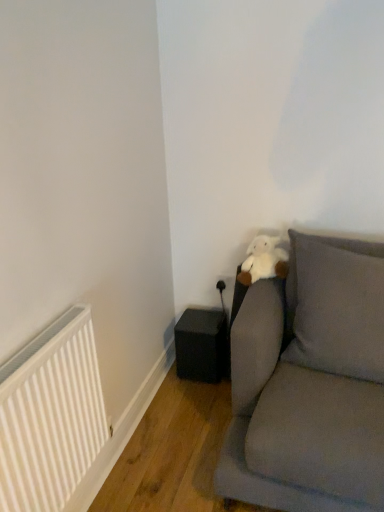
Question: Is gray fabric pillow at upper right completely or partially inside velvet gray couch at right?

Choices:
 (A) yes
 (B) no

Answer: (A)

Question: Is velvet gray couch at right not inside gray fabric pillow at upper right?

Choices:
 (A) no
 (B) yes

Answer: (B)

Question: Is velvet gray couch at right next to gray fabric pillow at upper right and touching it?

Choices:
 (A) no
 (B) yes

Answer: (A)

Question: Is the depth of velvet gray couch at right less than that of gray fabric pillow at upper right?

Choices:
 (A) no
 (B) yes

Answer: (B)

Question: From the image's perspective, is velvet gray couch at right over gray fabric pillow at upper right?

Choices:
 (A) yes
 (B) no

Answer: (B)

Question: From the image's perspective, does velvet gray couch at right appear lower than gray fabric pillow at upper right?

Choices:
 (A) yes
 (B) no

Answer: (A)

Question: Can you confirm if gray fabric pillow at upper right is wider than velvet gray couch at right?

Choices:
 (A) no
 (B) yes

Answer: (A)

Question: Does gray fabric pillow at upper right have a larger size compared to velvet gray couch at right?

Choices:
 (A) no
 (B) yes

Answer: (A)

Question: Is gray fabric pillow at upper right behind velvet gray couch at right?

Choices:
 (A) yes
 (B) no

Answer: (A)

Question: Is gray fabric pillow at upper right oriented away from velvet gray couch at right?

Choices:
 (A) yes
 (B) no

Answer: (A)

Question: Can you confirm if gray fabric pillow at upper right is positioned to the left of velvet gray couch at right?

Choices:
 (A) no
 (B) yes

Answer: (A)

Question: Could you tell me if gray fabric pillow at upper right is facing velvet gray couch at right?

Choices:
 (A) yes
 (B) no

Answer: (A)

Question: Considering the relative sizes of black matte speaker at lower left and velvet gray couch at right in the image provided, is black matte speaker at lower left thinner than velvet gray couch at right?

Choices:
 (A) no
 (B) yes

Answer: (B)